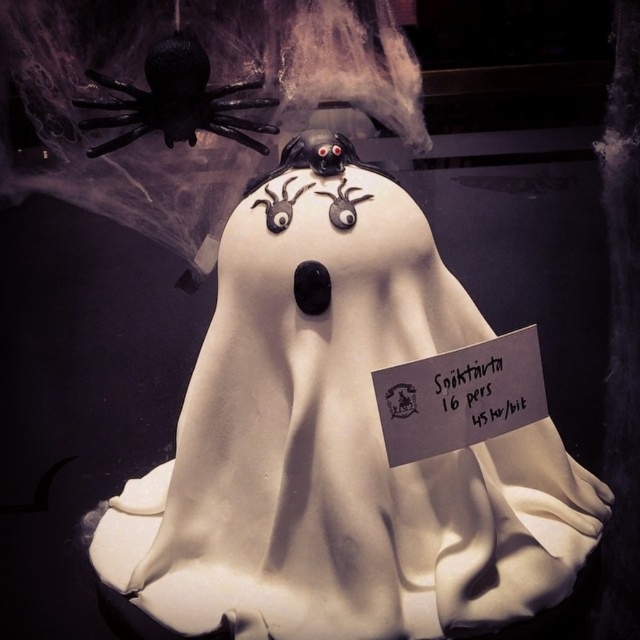
Question: Observing the image, what is the correct spatial positioning of black matte spider at upper left in reference to white paper sign at center?

Choices:
 (A) left
 (B) right

Answer: (A)

Question: Where is white fondant ghost at center located in relation to white paper sign at center in the image?

Choices:
 (A) right
 (B) left

Answer: (B)

Question: Which point appears closest to the camera in this image?

Choices:
 (A) (132, 99)
 (B) (269, 176)

Answer: (B)

Question: Estimate the real-world distances between objects in this image. Which object is farther from the white fondant ghost at center?

Choices:
 (A) black matte spider at upper left
 (B) white paper sign at center

Answer: (A)

Question: Is black matte spider at upper left to the right of white paper sign at center from the viewer's perspective?

Choices:
 (A) no
 (B) yes

Answer: (A)

Question: Considering the real-world distances, which object is closest to the black matte spider at upper left?

Choices:
 (A) white paper sign at center
 (B) white fondant ghost at center

Answer: (B)